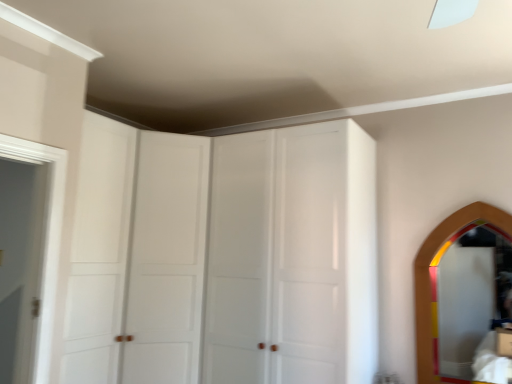
Measure the distance between point (11, 366) and camera.

The depth of point (11, 366) is 1.99 meters.

Image resolution: width=512 pixels, height=384 pixels. What do you see at coordinates (276, 257) in the screenshot? I see `white glossy cabinet at center, arranged as the first glass door when viewed from the right` at bounding box center [276, 257].

The width and height of the screenshot is (512, 384). What do you see at coordinates (136, 255) in the screenshot?
I see `white glossy cabinet doors at upper center, which is the second glass door from right to left` at bounding box center [136, 255].

Describe the element at coordinates (473, 308) in the screenshot. I see `wooden mirror at right` at that location.

Locate an element on the screen. The height and width of the screenshot is (384, 512). white wooden door at left is located at coordinates (20, 265).

From the image's perspective, is white glossy cabinet at center, arranged as the first glass door when viewed from the right, over wooden mirror at right?

Yes, from the image's perspective, white glossy cabinet at center, arranged as the first glass door when viewed from the right, is over wooden mirror at right.

Is white glossy cabinet at center, arranged as the first glass door when viewed from the right, not near wooden mirror at right?

Indeed, white glossy cabinet at center, arranged as the first glass door when viewed from the right, is not near wooden mirror at right.

From their relative heights in the image, would you say white glossy cabinet at center, arranged as the first glass door when viewed from the right, is taller or shorter than wooden mirror at right?

white glossy cabinet at center, arranged as the first glass door when viewed from the right, is taller than wooden mirror at right.

Is white glossy cabinet doors at upper center, positioned as the first glass door in left-to-right order, a part of white wooden door at left?

No, white glossy cabinet doors at upper center, positioned as the first glass door in left-to-right order, is not surrounded by white wooden door at left.

From a real-world perspective, does white wooden door at left stand above white glossy cabinet doors at upper center, which is the second glass door from right to left?

Indeed, from a real-world perspective, white wooden door at left stands above white glossy cabinet doors at upper center, which is the second glass door from right to left.

Between white wooden door at left and white glossy cabinet doors at upper center, which is the second glass door from right to left, which one has smaller size?

white wooden door at left.

How far apart are white glossy cabinet doors at upper center, positioned as the first glass door in left-to-right order, and white wooden door at left?

white glossy cabinet doors at upper center, positioned as the first glass door in left-to-right order, and white wooden door at left are 25.73 inches apart from each other.

Considering the sizes of objects white glossy cabinet doors at upper center, which is the second glass door from right to left, and white wooden door at left in the image provided, who is wider, white glossy cabinet doors at upper center, which is the second glass door from right to left, or white wooden door at left?

white glossy cabinet doors at upper center, which is the second glass door from right to left.

Does white glossy cabinet doors at upper center, positioned as the first glass door in left-to-right order, turn towards white wooden door at left?

No, white glossy cabinet doors at upper center, positioned as the first glass door in left-to-right order, is not aimed at white wooden door at left.

The height and width of the screenshot is (384, 512). There is a white wooden door at left. Identify the location of the 2nd glass door below it (from a real-world perspective). (136, 255).

Does white glossy cabinet at center, positioned as the 2th glass door in left-to-right order, have a greater width compared to white glossy cabinet doors at upper center, positioned as the first glass door in left-to-right order?

No.

Is white glossy cabinet at center, positioned as the 2th glass door in left-to-right order, to the right of white glossy cabinet doors at upper center, positioned as the first glass door in left-to-right order, from the viewer's perspective?

Yes, white glossy cabinet at center, positioned as the 2th glass door in left-to-right order, is to the right of white glossy cabinet doors at upper center, positioned as the first glass door in left-to-right order.

Considering the positions of point (249, 224) and point (125, 269), is point (249, 224) closer or farther from the camera than point (125, 269)?

Point (249, 224) is farther from the camera than point (125, 269).

Is white glossy cabinet at center, arranged as the first glass door when viewed from the right, facing away from white glossy cabinet doors at upper center, positioned as the first glass door in left-to-right order?

No, white glossy cabinet at center, arranged as the first glass door when viewed from the right, is not facing the opposite direction of white glossy cabinet doors at upper center, positioned as the first glass door in left-to-right order.

Could you tell me if white wooden door at left is turned towards wooden mirror at right?

No, white wooden door at left is not oriented towards wooden mirror at right.

From the image's perspective, who appears lower, white wooden door at left or wooden mirror at right?

wooden mirror at right appears lower in the image.

Locate an element on the screen. The height and width of the screenshot is (384, 512). mirror below the white wooden door at left (from the image's perspective) is located at coordinates (473, 308).

How many degrees apart are the facing directions of white wooden door at left and wooden mirror at right?

The angular difference between white wooden door at left and wooden mirror at right is 92.1 degrees.

Considering the positions of objects wooden mirror at right and white glossy cabinet at center, arranged as the first glass door when viewed from the right, in the image provided, who is more to the left, wooden mirror at right or white glossy cabinet at center, arranged as the first glass door when viewed from the right,?

From the viewer's perspective, white glossy cabinet at center, arranged as the first glass door when viewed from the right, appears more on the left side.

Is wooden mirror at right not near white glossy cabinet at center, positioned as the 2th glass door in left-to-right order?

Indeed, wooden mirror at right is not near white glossy cabinet at center, positioned as the 2th glass door in left-to-right order.

Considering the relative sizes of wooden mirror at right and white glossy cabinet at center, positioned as the 2th glass door in left-to-right order, in the image provided, is wooden mirror at right bigger than white glossy cabinet at center, positioned as the 2th glass door in left-to-right order,?

No.

Looking at this image, is wooden mirror at right aimed at white glossy cabinet at center, positioned as the 2th glass door in left-to-right order?

No, wooden mirror at right is not facing towards white glossy cabinet at center, positioned as the 2th glass door in left-to-right order.

Is white glossy cabinet doors at upper center, positioned as the first glass door in left-to-right order, located within wooden mirror at right?

That's incorrect, white glossy cabinet doors at upper center, positioned as the first glass door in left-to-right order, is not inside wooden mirror at right.

Can you confirm if wooden mirror at right is smaller than white glossy cabinet doors at upper center, which is the second glass door from right to left?

Indeed, wooden mirror at right has a smaller size compared to white glossy cabinet doors at upper center, which is the second glass door from right to left.

Looking at this image, which of these two, wooden mirror at right or white glossy cabinet doors at upper center, which is the second glass door from right to left, is thinner?

Thinner between the two is wooden mirror at right.

Is white glossy cabinet doors at upper center, which is the second glass door from right to left, at the back of wooden mirror at right?

No, wooden mirror at right is not facing away from white glossy cabinet doors at upper center, which is the second glass door from right to left.

This screenshot has height=384, width=512. What are the coordinates of `mirror behind the white glossy cabinet at center, positioned as the 2th glass door in left-to-right order` in the screenshot? It's located at (473, 308).

I want to click on door above the white glossy cabinet doors at upper center, positioned as the first glass door in left-to-right order (from a real-world perspective), so click(20, 265).

From the image, which object appears to be farther from white wooden door at left, wooden mirror at right or white glossy cabinet doors at upper center, positioned as the first glass door in left-to-right order?

wooden mirror at right is further to white wooden door at left.

Estimate the real-world distances between objects in this image. Which object is further from white glossy cabinet at center, arranged as the first glass door when viewed from the right, white glossy cabinet doors at upper center, positioned as the first glass door in left-to-right order, or wooden mirror at right?

wooden mirror at right is further to white glossy cabinet at center, arranged as the first glass door when viewed from the right.

Estimate the real-world distances between objects in this image. Which object is further from white wooden door at left, white glossy cabinet at center, arranged as the first glass door when viewed from the right, or wooden mirror at right?

Based on the image, wooden mirror at right appears to be further to white wooden door at left.

From the image, which object appears to be farther from white wooden door at left, wooden mirror at right or white glossy cabinet at center, positioned as the 2th glass door in left-to-right order?

Based on the image, wooden mirror at right appears to be further to white wooden door at left.

Based on their spatial positions, is wooden mirror at right or white glossy cabinet at center, arranged as the first glass door when viewed from the right, closer to white glossy cabinet doors at upper center, which is the second glass door from right to left?

white glossy cabinet at center, arranged as the first glass door when viewed from the right, is closer to white glossy cabinet doors at upper center, which is the second glass door from right to left.

Looking at this image, estimate the real-world distances between objects in this image. Which object is closer to wooden mirror at right, white wooden door at left or white glossy cabinet at center, arranged as the first glass door when viewed from the right?

Among the two, white glossy cabinet at center, arranged as the first glass door when viewed from the right, is located nearer to wooden mirror at right.

Based on their spatial positions, is white glossy cabinet at center, arranged as the first glass door when viewed from the right, or white wooden door at left closer to wooden mirror at right?

white glossy cabinet at center, arranged as the first glass door when viewed from the right, is closer to wooden mirror at right.

Looking at this image, based on their spatial positions, is white wooden door at left or white glossy cabinet doors at upper center, positioned as the first glass door in left-to-right order, further from wooden mirror at right?

white wooden door at left.

The image size is (512, 384). Find the location of `glass door between white glossy cabinet doors at upper center, positioned as the first glass door in left-to-right order, and wooden mirror at right from left to right`. glass door between white glossy cabinet doors at upper center, positioned as the first glass door in left-to-right order, and wooden mirror at right from left to right is located at coordinates (276, 257).

Where is `glass door located between white wooden door at left and white glossy cabinet at center, arranged as the first glass door when viewed from the right, in the left-right direction`? glass door located between white wooden door at left and white glossy cabinet at center, arranged as the first glass door when viewed from the right, in the left-right direction is located at coordinates (136, 255).